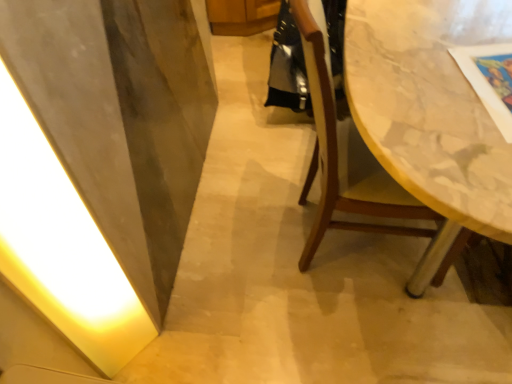
Question: Is point (91, 294) positioned closer to the camera than point (287, 87)?

Choices:
 (A) farther
 (B) closer

Answer: (B)

Question: Looking at their shapes, would you say white glossy light at left is wider or thinner than shiny black robe at center?

Choices:
 (A) wide
 (B) thin

Answer: (B)

Question: Which object is the farthest from the shiny black robe at center?

Choices:
 (A) white glossy light at left
 (B) wooden chair at right

Answer: (A)

Question: Which object is the farthest from the wooden chair at right?

Choices:
 (A) white glossy light at left
 (B) shiny black robe at center

Answer: (A)